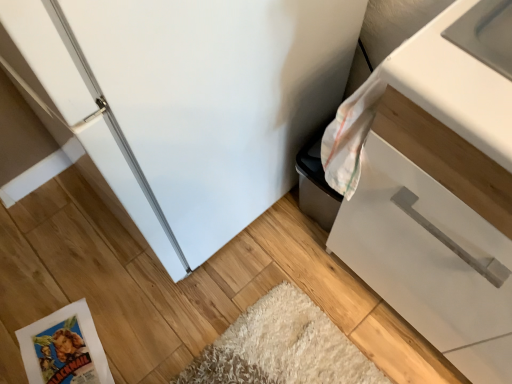
Question: Looking at the image, does white matte cabinet at right seem bigger or smaller compared to white paper comic book at lower left?

Choices:
 (A) small
 (B) big

Answer: (B)

Question: Would you say white matte cabinet at right is to the left or to the right of white paper comic book at lower left in the picture?

Choices:
 (A) right
 (B) left

Answer: (A)

Question: In the image, is white matte cabinet at right positioned in front of or behind white paper comic book at lower left?

Choices:
 (A) behind
 (B) front

Answer: (B)

Question: From a real-world perspective, is white paper comic book at lower left physically located above or below white matte cabinet at right?

Choices:
 (A) above
 (B) below

Answer: (B)

Question: In the image, is white paper comic book at lower left on the left side or the right side of white matte cabinet at right?

Choices:
 (A) left
 (B) right

Answer: (A)

Question: Is white paper comic book at lower left situated inside white matte cabinet at right or outside?

Choices:
 (A) inside
 (B) outside

Answer: (B)

Question: Considering the positions of white paper comic book at lower left and white matte cabinet at right in the image, is white paper comic book at lower left taller or shorter than white matte cabinet at right?

Choices:
 (A) short
 (B) tall

Answer: (A)